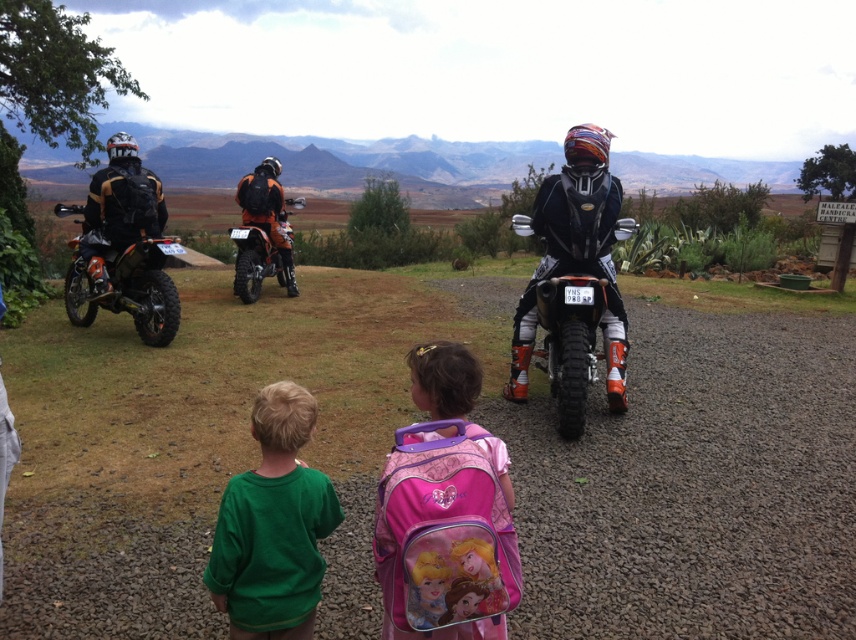
Question: Does green cotton shirt at lower left appear over matte black motorcycle at left?

Choices:
 (A) yes
 (B) no

Answer: (B)

Question: Which object is farther from the camera taking this photo?

Choices:
 (A) matte black motorcycle at center
 (B) dirt/gravel road at center
 (C) matte black motorcycle at left

Answer: (C)

Question: Observing the image, what is the correct spatial positioning of dirt/gravel road at center in reference to matte black motorcycle at center?

Choices:
 (A) above
 (B) below

Answer: (B)

Question: Which point is closer to the camera taking this photo?

Choices:
 (A) (450, 628)
 (B) (290, 241)
 (C) (239, 513)

Answer: (C)

Question: Which object is positioned farthest from the orange matte dirt bike at left?

Choices:
 (A) pink fabric backpack at center
 (B) dirt/gravel road at center
 (C) green cotton shirt at lower left

Answer: (A)

Question: Is green cotton shirt at lower left below matte black motorcycle at left?

Choices:
 (A) yes
 (B) no

Answer: (A)